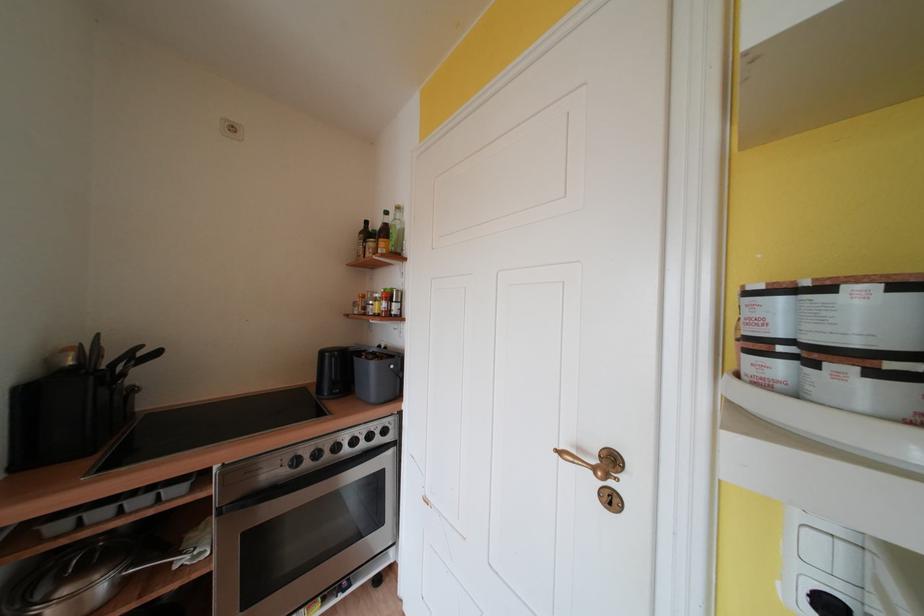
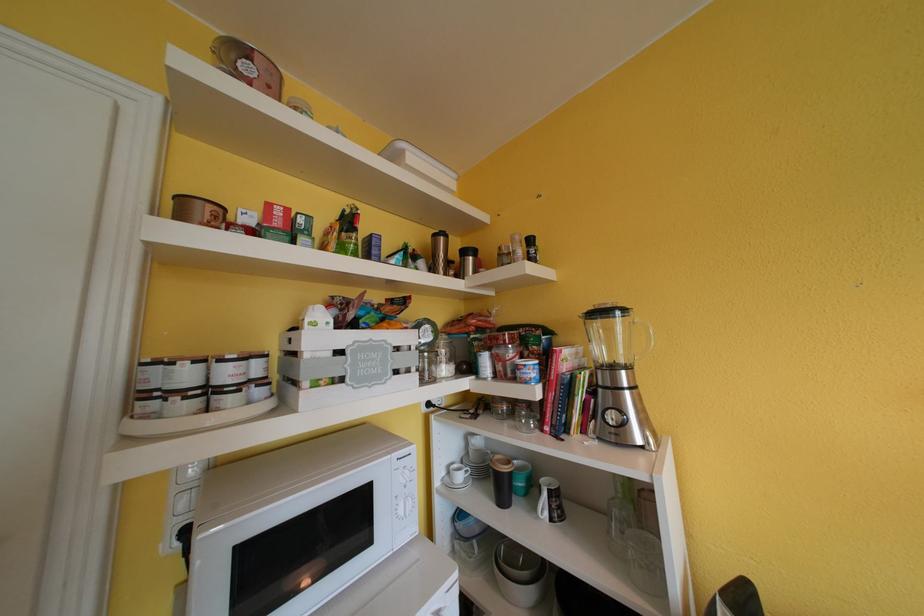
Question: The images are taken continuously from a first-person perspective. In which direction is your viewpoint rotating?

Choices:
 (A) Left
 (B) Right
 (C) Up
 (D) Down

Answer: (B)